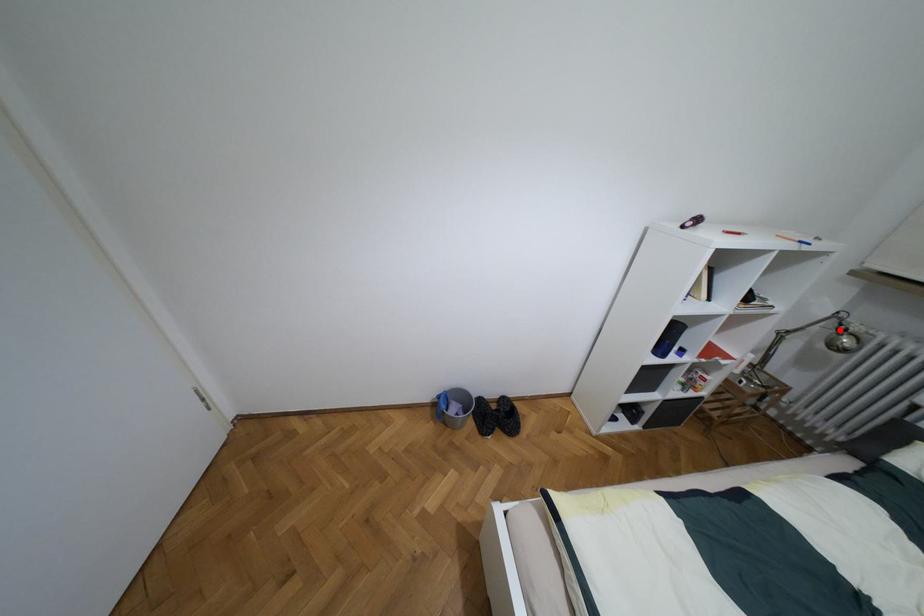
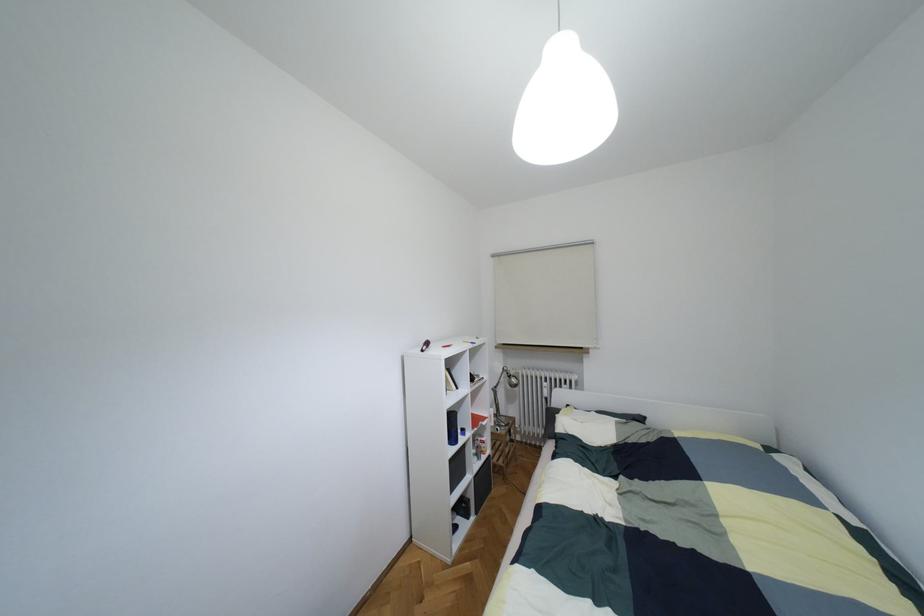
Question: A red point is marked in image1. In image2, is the corresponding 3D point closer to the camera or farther? Reply with the corresponding letter.

Choices:
 (A) The corresponding 3D point is closer.
 (B) The corresponding 3D point is farther.

Answer: (B)